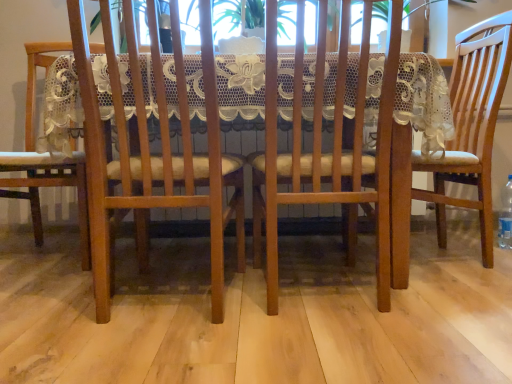
This screenshot has height=384, width=512. In order to click on free space below wooden table at center (from a real-world perspective) in this screenshot , I will do `click(250, 259)`.